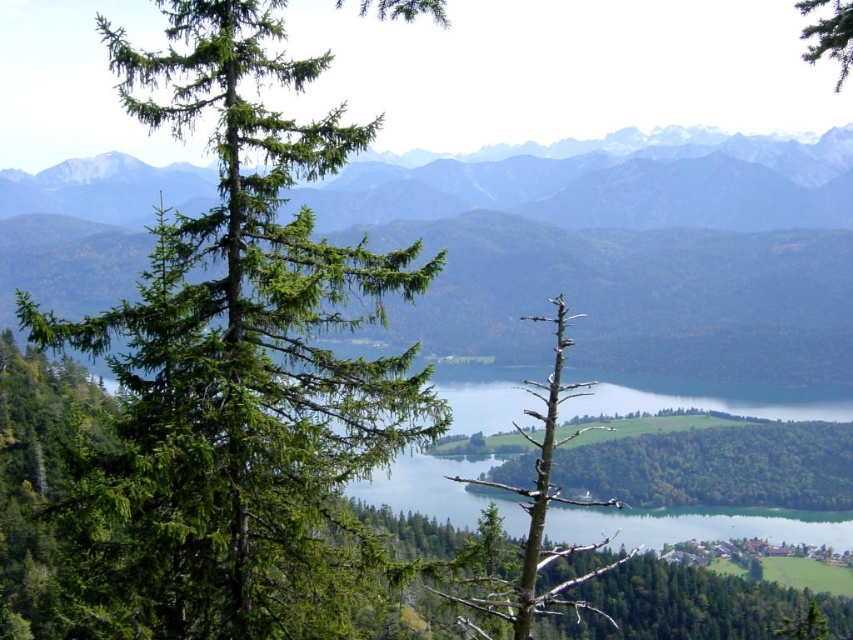
Is point (838, 426) behind point (550, 499)?

Yes, point (838, 426) is farther from viewer.

Who is positioned more to the left, green leafy tree at center or brown/dried wood tree at center?

brown/dried wood tree at center is more to the left.

Who is more distant from viewer, (x=606, y=442) or (x=453, y=595)?

Positioned behind is point (x=606, y=442).

Find the location of a particular element. green leafy tree at center is located at coordinates (717, 467).

Does green matte tree at left have a lesser height compared to green needle-like tree at upper right?

Indeed, green matte tree at left has a lesser height compared to green needle-like tree at upper right.

Is point (297, 577) closer to camera compared to point (851, 19)?

Yes, it is.

In order to click on green matte tree at left in this screenshot , I will do `click(238, 365)`.

Who is shorter, green leafy tree at center or green needle-like tree at upper right?

green leafy tree at center is shorter.

Is green leafy tree at center below green needle-like tree at upper right?

Yes.

Between point (721, 432) and point (802, 6), which one is positioned behind?

Positioned behind is point (721, 432).

The height and width of the screenshot is (640, 853). What are the coordinates of `green leafy tree at center` in the screenshot? It's located at (717, 467).